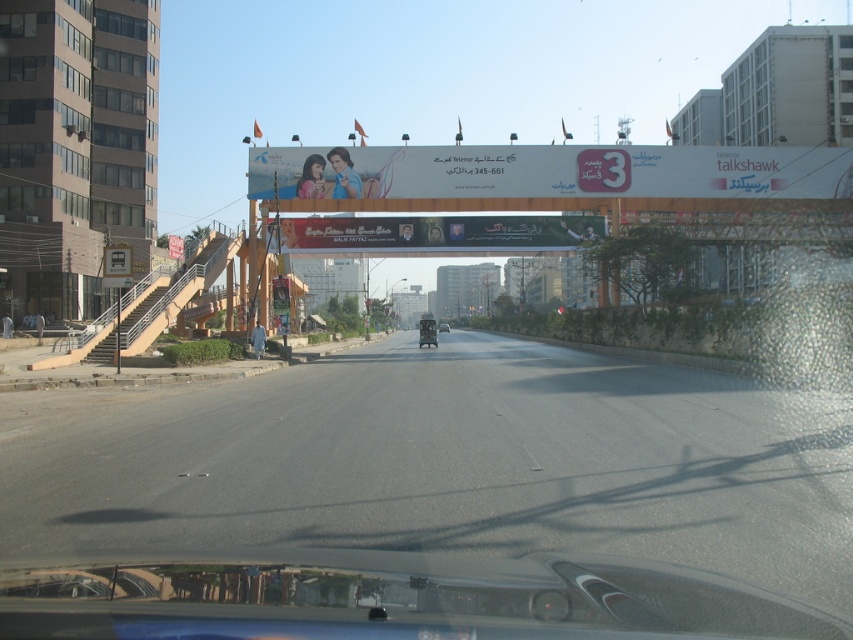
Question: Does asphalt road at center lie behind metallic silver car at center?

Choices:
 (A) yes
 (B) no

Answer: (B)

Question: Among these objects, which one is nearest to the camera?

Choices:
 (A) transparent glass windshield at center
 (B) metallic silver car at center
 (C) asphalt road at center

Answer: (A)

Question: Is transparent glass windshield at center to the left of metallic silver car at center from the viewer's perspective?

Choices:
 (A) yes
 (B) no

Answer: (A)

Question: Is transparent glass windshield at center above metallic silver car at center?

Choices:
 (A) yes
 (B) no

Answer: (B)

Question: Which object is positioned farthest from the transparent glass windshield at center?

Choices:
 (A) metallic silver car at center
 (B) asphalt road at center

Answer: (A)

Question: Which of the following is the closest to the observer?

Choices:
 (A) (299, 566)
 (B) (592, 365)

Answer: (A)